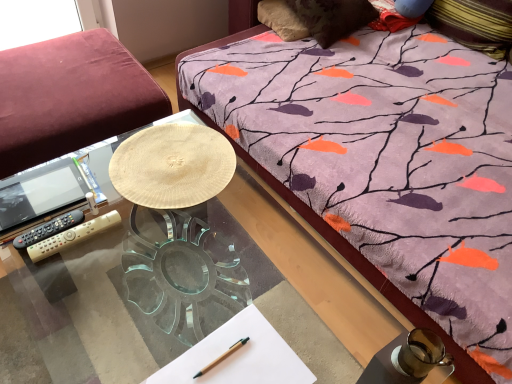
Question: Which is correct: white paper at center is inside velvet burgundy studio couch at left, or outside of it?

Choices:
 (A) inside
 (B) outside

Answer: (B)

Question: From a real-world perspective, is white paper at center physically located above or below velvet burgundy studio couch at left?

Choices:
 (A) below
 (B) above

Answer: (B)

Question: Which object is the farthest from the wooden pen at lower center?

Choices:
 (A) black plastic remote control at left, the second remote control in the right-to-left sequence
 (B) purple fabric pillow at upper right, which ranks as the 1th pillow in right-to-left order
 (C) transparent glass desk at center
 (D) white paper at center
 (E) suede-like brown pillow at upper center, the 1th pillow in the left-to-right sequence

Answer: (B)

Question: Which object is positioned closest to the velvet burgundy studio couch at left?

Choices:
 (A) suede-like brown pillow at upper center, which is the 2th pillow from right to left
 (B) gold plastic remote control at lower left, acting as the first remote control starting from the right
 (C) transparent glass desk at center
 (D) white paper at center
 (E) purple fabric pillow at upper right, the 2th pillow viewed from the left

Answer: (B)